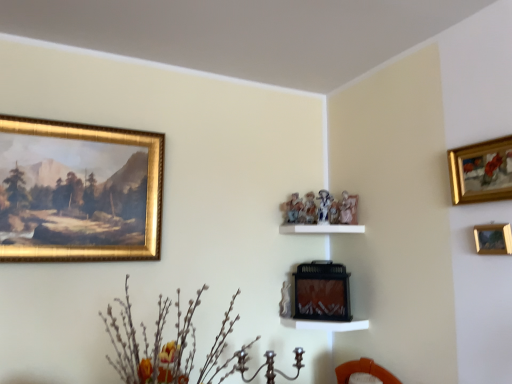
The height and width of the screenshot is (384, 512). Describe the element at coordinates (321, 229) in the screenshot. I see `white glossy shelf at center` at that location.

Where is `white glossy shelf at center`? The image size is (512, 384). white glossy shelf at center is located at coordinates (x=321, y=229).

What is the approximate width of matte black fireplace at center, which ranks as the 1th picture frame in back-to-front order?

The width of matte black fireplace at center, which ranks as the 1th picture frame in back-to-front order, is 6.62 inches.

I want to click on wooden picture frame at upper right, which is the 3th picture frame from back to front, so click(493, 239).

The height and width of the screenshot is (384, 512). Identify the location of white glossy shelf at center. (321, 229).

What's the angular difference between matte black fireplace at center, the 3th picture frame viewed from the right, and silvery metallic branches at lower left's facing directions?

The facing directions of matte black fireplace at center, the 3th picture frame viewed from the right, and silvery metallic branches at lower left are 65 degrees apart.

Looking at their sizes, would you say matte black fireplace at center, the 3th picture frame viewed from the right, is wider or thinner than silvery metallic branches at lower left?

In the image, matte black fireplace at center, the 3th picture frame viewed from the right, appears to be more narrow than silvery metallic branches at lower left.

From the image's perspective, which one is positioned lower, matte black fireplace at center, the 3th picture frame viewed from the right, or silvery metallic branches at lower left?

matte black fireplace at center, the 3th picture frame viewed from the right, appears lower in the image.

From a real-world perspective, who is located lower, gold-framed painting at upper right, the first picture frame viewed from the right, or matte black fireplace at center, acting as the fourth picture frame starting from the front?

In real-world perspective, matte black fireplace at center, acting as the fourth picture frame starting from the front, is lower.

From the picture: Measure the distance between gold-framed painting at upper right, the fourth picture frame when ordered from left to right, and matte black fireplace at center, which ranks as the 1th picture frame in back-to-front order.

The distance of gold-framed painting at upper right, the fourth picture frame when ordered from left to right, from matte black fireplace at center, which ranks as the 1th picture frame in back-to-front order, is 33.52 inches.

Which object is closer to the camera taking this photo, gold-framed painting at upper right, positioned as the first picture frame in front-to-back order, or matte black fireplace at center, the 2th picture frame when ordered from left to right?

gold-framed painting at upper right, positioned as the first picture frame in front-to-back order, is closer to the camera.

Is gold-framed painting at upper right, the fourth picture frame when ordered from left to right, far away from wooden picture frame at upper right, which is the 3th picture frame from back to front?

That's not correct — gold-framed painting at upper right, the fourth picture frame when ordered from left to right, is a little close to wooden picture frame at upper right, which is the 3th picture frame from back to front.

From a real-world perspective, between gold-framed painting at upper right, the fourth picture frame positioned from the back, and wooden picture frame at upper right, which is the 3th picture frame from back to front, who is vertically higher?

gold-framed painting at upper right, the fourth picture frame positioned from the back.

How different are the orientations of gold-framed painting at upper right, the first picture frame viewed from the right, and wooden picture frame at upper right, acting as the 3th picture frame starting from the left, in degrees?

The angle between the facing direction of gold-framed painting at upper right, the first picture frame viewed from the right, and the facing direction of wooden picture frame at upper right, acting as the 3th picture frame starting from the left, is 0.000276 degrees.

Which of these two, gold-framed painting at upper right, positioned as the first picture frame in front-to-back order, or wooden picture frame at upper right, the second picture frame when ordered from front to back, stands shorter?

wooden picture frame at upper right, the second picture frame when ordered from front to back, is shorter.

Based on the photo, would you say silvery metallic branches at lower left is inside or outside gold-framed painting at upper left, the fourth picture frame positioned from the right?

silvery metallic branches at lower left cannot be found inside gold-framed painting at upper left, the fourth picture frame positioned from the right.

Can you confirm if silvery metallic branches at lower left is thinner than gold-framed painting at upper left, acting as the second picture frame starting from the back?

In fact, silvery metallic branches at lower left might be wider than gold-framed painting at upper left, acting as the second picture frame starting from the back.

From a real-world perspective, is silvery metallic branches at lower left physically above gold-framed painting at upper left, the first picture frame in the left-to-right sequence?

No, from a real-world perspective, silvery metallic branches at lower left is not over gold-framed painting at upper left, the first picture frame in the left-to-right sequence

From the image's perspective, is silvery metallic branches at lower left over gold-framed painting at upper left, the first picture frame in the left-to-right sequence?

No, from the image's perspective, silvery metallic branches at lower left is not over gold-framed painting at upper left, the first picture frame in the left-to-right sequence.

Based on their sizes in the image, would you say gold-framed painting at upper left, the third picture frame viewed from the front, is bigger or smaller than silvery metallic branches at lower left?

gold-framed painting at upper left, the third picture frame viewed from the front, is smaller than silvery metallic branches at lower left.

Between gold-framed painting at upper left, the third picture frame viewed from the front, and silvery metallic branches at lower left, which one has more height?

Standing taller between the two is gold-framed painting at upper left, the third picture frame viewed from the front.

Does gold-framed painting at upper left, acting as the second picture frame starting from the back, contain silvery metallic branches at lower left?

That's incorrect, silvery metallic branches at lower left is not inside gold-framed painting at upper left, acting as the second picture frame starting from the back.

Locate an element on the screen. The image size is (512, 384). the 1st picture frame to the right when counting from the matte black fireplace at center, which ranks as the 1th picture frame in back-to-front order is located at coordinates (493, 239).

Which is more to the right, matte black fireplace at center, which ranks as the 1th picture frame in back-to-front order, or wooden picture frame at upper right, which is the 3th picture frame from back to front?

Positioned to the right is wooden picture frame at upper right, which is the 3th picture frame from back to front.

Which is behind, matte black fireplace at center, the 2th picture frame when ordered from left to right, or wooden picture frame at upper right, which is the 3th picture frame from back to front?

matte black fireplace at center, the 2th picture frame when ordered from left to right, is further away from the camera.

From the image's perspective, between matte black fireplace at center, which ranks as the 1th picture frame in back-to-front order, and wooden picture frame at upper right, which is the 3th picture frame from back to front, who is located below?

matte black fireplace at center, which ranks as the 1th picture frame in back-to-front order.

Is silvery metallic branches at lower left a part of wooden picture frame at upper right, which is the 3th picture frame from back to front?

No, wooden picture frame at upper right, which is the 3th picture frame from back to front, does not contain silvery metallic branches at lower left.

Is wooden picture frame at upper right, the 2th picture frame when ordered from right to left, further to camera compared to silvery metallic branches at lower left?

Yes, wooden picture frame at upper right, the 2th picture frame when ordered from right to left, is further from the viewer.

Is wooden picture frame at upper right, the second picture frame when ordered from front to back, far from silvery metallic branches at lower left?

Absolutely, wooden picture frame at upper right, the second picture frame when ordered from front to back, is distant from silvery metallic branches at lower left.

Who is bigger, wooden picture frame at upper right, acting as the 3th picture frame starting from the left, or silvery metallic branches at lower left?

With larger size is silvery metallic branches at lower left.

In order to click on the 4th picture frame behind the silvery metallic branches at lower left, starting your count from the anchor in this screenshot , I will do `click(322, 291)`.

Starting from the gold-framed painting at upper right, the fourth picture frame when ordered from left to right, which picture frame is the 2nd one to the left? Please provide its 2D coordinates.

[(322, 291)]

Considering their positions, is wooden picture frame at upper right, the second picture frame when ordered from front to back, positioned further to gold-framed painting at upper left, acting as the second picture frame starting from the back, than matte black fireplace at center, which ranks as the 1th picture frame in back-to-front order?

wooden picture frame at upper right, the second picture frame when ordered from front to back.

Considering their positions, is matte black fireplace at center, the 3th picture frame viewed from the right, positioned further to white glossy shelf at center than gold-framed painting at upper right, the fourth picture frame positioned from the back?

gold-framed painting at upper right, the fourth picture frame positioned from the back, is further to white glossy shelf at center.

Based on their spatial positions, is silvery metallic branches at lower left or matte black fireplace at center, the 2th picture frame when ordered from left to right, further from wooden picture frame at upper right, acting as the 3th picture frame starting from the left?

Based on the image, silvery metallic branches at lower left appears to be further to wooden picture frame at upper right, acting as the 3th picture frame starting from the left.

Based on their spatial positions, is white glossy shelf at center or wooden picture frame at upper right, the 2th picture frame when ordered from right to left, further from matte black fireplace at center, the 3th picture frame viewed from the right?

Among the two, wooden picture frame at upper right, the 2th picture frame when ordered from right to left, is located further to matte black fireplace at center, the 3th picture frame viewed from the right.

In the scene shown: Considering their positions, is silvery metallic branches at lower left positioned closer to white glossy shelf at center than gold-framed painting at upper right, the fourth picture frame positioned from the back?

gold-framed painting at upper right, the fourth picture frame positioned from the back, is positioned closer to the anchor white glossy shelf at center.

Based on their spatial positions, is white glossy shelf at center or matte black fireplace at center, the 3th picture frame viewed from the right, further from gold-framed painting at upper left, the first picture frame in the left-to-right sequence?

matte black fireplace at center, the 3th picture frame viewed from the right, lies further to gold-framed painting at upper left, the first picture frame in the left-to-right sequence, than the other object.

Considering their positions, is matte black fireplace at center, which ranks as the 1th picture frame in back-to-front order, positioned further to white glossy shelf at center than gold-framed painting at upper left, the fourth picture frame positioned from the right?

Based on the image, gold-framed painting at upper left, the fourth picture frame positioned from the right, appears to be further to white glossy shelf at center.

Considering their positions, is silvery metallic branches at lower left positioned further to gold-framed painting at upper right, the fourth picture frame positioned from the back, than gold-framed painting at upper left, the first picture frame in the left-to-right sequence?

gold-framed painting at upper left, the first picture frame in the left-to-right sequence.

Find the location of a particular element. Image resolution: width=512 pixels, height=384 pixels. picture frame between gold-framed painting at upper left, acting as the second picture frame starting from the back, and wooden picture frame at upper right, the second picture frame when ordered from front to back, in the horizontal direction is located at coordinates (322, 291).

Find the location of a particular element. Image resolution: width=512 pixels, height=384 pixels. shelf positioned between wooden picture frame at upper right, the second picture frame when ordered from front to back, and matte black fireplace at center, which ranks as the 1th picture frame in back-to-front order, from near to far is located at coordinates (321, 229).

Locate an element on the screen. The image size is (512, 384). shelf between silvery metallic branches at lower left and matte black fireplace at center, the 3th picture frame viewed from the right, in the front-back direction is located at coordinates (321, 229).

This screenshot has width=512, height=384. Identify the location of floral arrangement between gold-framed painting at upper left, the third picture frame viewed from the front, and wooden picture frame at upper right, the 2th picture frame when ordered from right to left, from left to right. (153, 344).